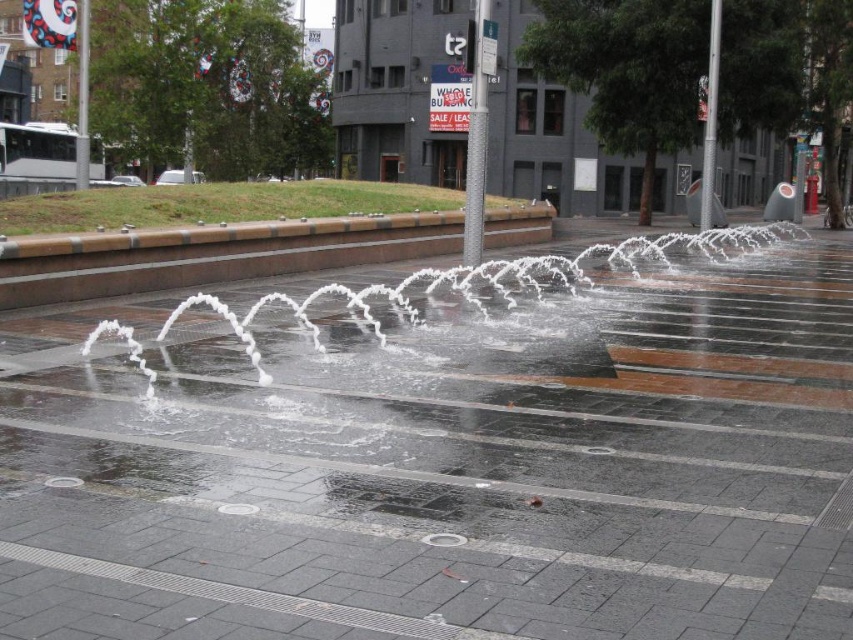
Question: Which of the following is the farthest from the observer?

Choices:
 (A) wet concrete pavement at center
 (B) brown concrete curb at center

Answer: (B)

Question: Can you confirm if wet concrete pavement at center is positioned to the right of brown concrete curb at center?

Choices:
 (A) no
 (B) yes

Answer: (B)

Question: Does wet concrete pavement at center appear over brown concrete curb at center?

Choices:
 (A) yes
 (B) no

Answer: (B)

Question: Is wet concrete pavement at center above brown concrete curb at center?

Choices:
 (A) yes
 (B) no

Answer: (B)

Question: Which object appears closest to the camera in this image?

Choices:
 (A) wet concrete pavement at center
 (B) brown concrete curb at center

Answer: (A)